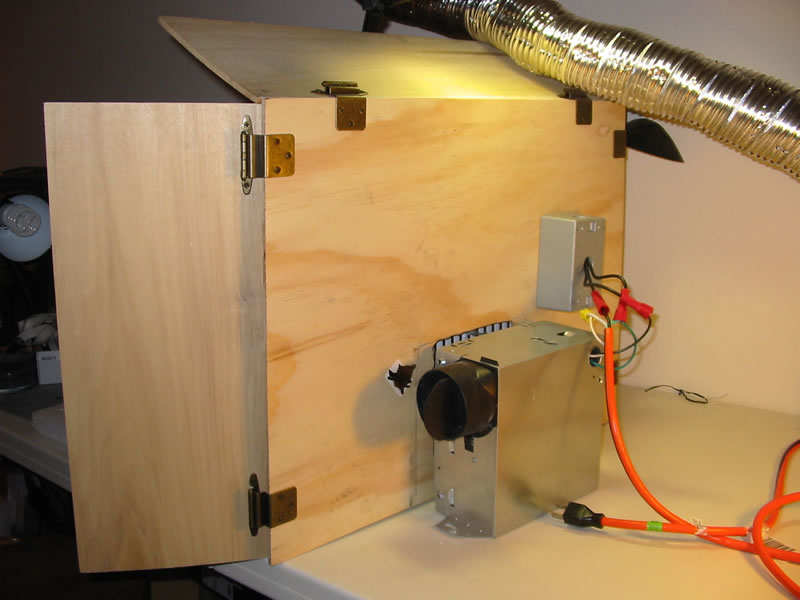
The height and width of the screenshot is (600, 800). Find the location of `tabletop`. tabletop is located at coordinates (680, 454).